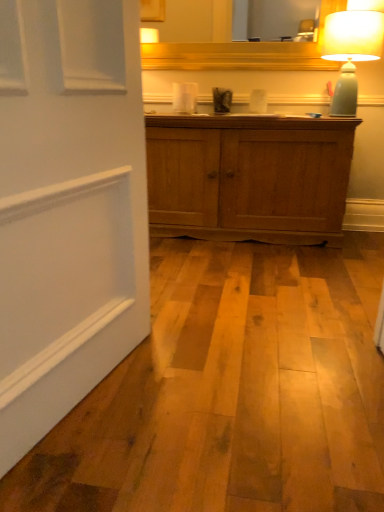
Question: From the image's perspective, relative to matte green ceramic lampshade at upper right, is wooden mirror at upper center above or below?

Choices:
 (A) below
 (B) above

Answer: (B)

Question: From their relative heights in the image, would you say wooden mirror at upper center is taller or shorter than matte green ceramic lampshade at upper right?

Choices:
 (A) short
 (B) tall

Answer: (A)

Question: Based on their positions, is wooden mirror at upper center located to the left or right of matte green ceramic lampshade at upper right?

Choices:
 (A) right
 (B) left

Answer: (B)

Question: Is point (337, 15) closer or farther from the camera than point (291, 53)?

Choices:
 (A) closer
 (B) farther

Answer: (A)

Question: Looking at their shapes, would you say matte green ceramic lampshade at upper right is wider or thinner than wooden mirror at upper center?

Choices:
 (A) wide
 (B) thin

Answer: (A)

Question: Considering the relative positions of matte green ceramic lampshade at upper right and wooden mirror at upper center in the image provided, is matte green ceramic lampshade at upper right to the left or to the right of wooden mirror at upper center?

Choices:
 (A) left
 (B) right

Answer: (B)

Question: From the image's perspective, relative to wooden mirror at upper center, is matte green ceramic lampshade at upper right above or below?

Choices:
 (A) above
 (B) below

Answer: (B)